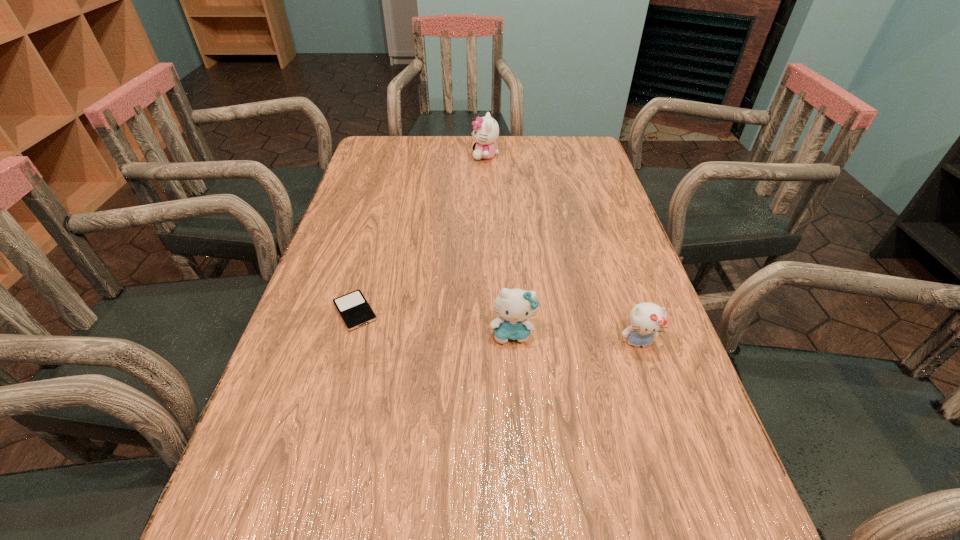
This screenshot has width=960, height=540. What are the coordinates of `object that is at the left edge` in the screenshot? It's located at (355, 311).

Locate an element on the screen. The width and height of the screenshot is (960, 540). object situated at the right edge is located at coordinates (646, 319).

In the image, there is a desktop. Where is `blank space at the far edge`? Image resolution: width=960 pixels, height=540 pixels. blank space at the far edge is located at coordinates (484, 162).

The width and height of the screenshot is (960, 540). What are the coordinates of `free location at the left edge of the desktop` in the screenshot? It's located at (387, 194).

In the image, there is a desktop. At what (x,y) coordinates should I click in order to perform the action: click on blank space at the right edge. Please return your answer as a coordinate pair (x, y). Image resolution: width=960 pixels, height=540 pixels. Looking at the image, I should click on pyautogui.click(x=562, y=211).

This screenshot has height=540, width=960. Find the location of `vacant region between the farthest kitten and the leftmost object`. vacant region between the farthest kitten and the leftmost object is located at coordinates (420, 233).

The height and width of the screenshot is (540, 960). Identify the location of empty space that is in between the farthest object and the shortest object. (420, 233).

Locate an element on the screen. the third closest object to the farthest kitten is located at coordinates (x=646, y=319).

Find the location of a particular element. the closest object relative to the rightmost object is located at coordinates (515, 306).

This screenshot has height=540, width=960. In order to click on kitten object that ranks as the closest to the leftmost object in this screenshot , I will do `click(515, 306)`.